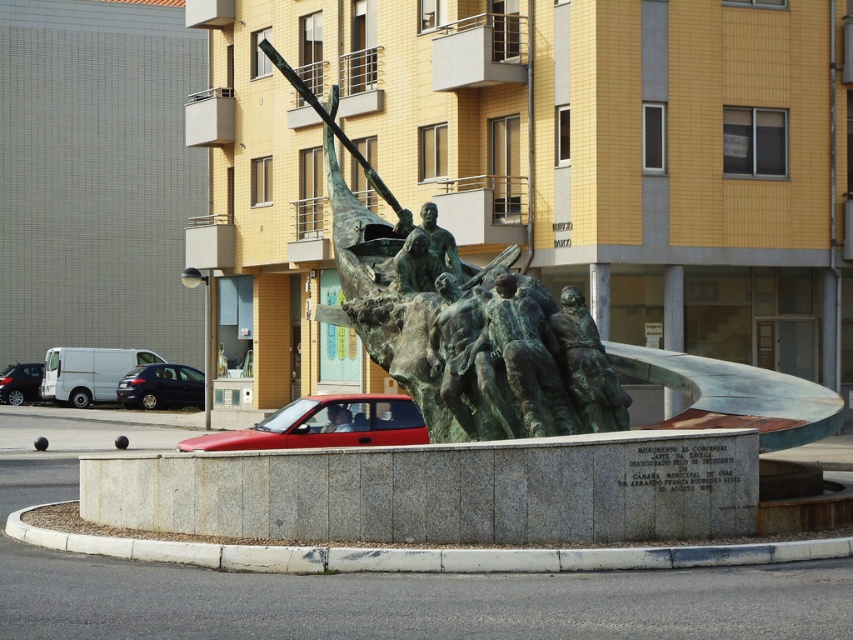
Does shiny red car at center have a greater width compared to matte black van at left?

Indeed, shiny red car at center has a greater width compared to matte black van at left.

The image size is (853, 640). Identify the location of shiny red car at center. (325, 424).

Where is `shiny red car at center`? Image resolution: width=853 pixels, height=640 pixels. shiny red car at center is located at coordinates (325, 424).

Is shiny red car at center bigger than shiny black car at lower left?

Yes, shiny red car at center is bigger than shiny black car at lower left.

Is point (326, 442) less distant than point (164, 369)?

Yes, it is.

Identify the location of shiny red car at center. This screenshot has width=853, height=640. click(x=325, y=424).

Who is taller, bronze statue at center or shiny red car at center?

shiny red car at center is taller.

Is bronze statue at center closer to camera compared to shiny red car at center?

Yes, it is in front of shiny red car at center.

Is point (337, 128) closer to camera compared to point (321, 396)?

Yes, it is.

The height and width of the screenshot is (640, 853). Identify the location of bronze statue at center. (457, 323).